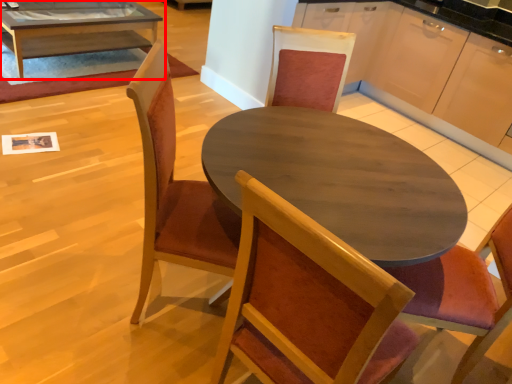
Question: In this image, where is coffee table (annotated by the red box) located relative to chair?

Choices:
 (A) right
 (B) left

Answer: (B)